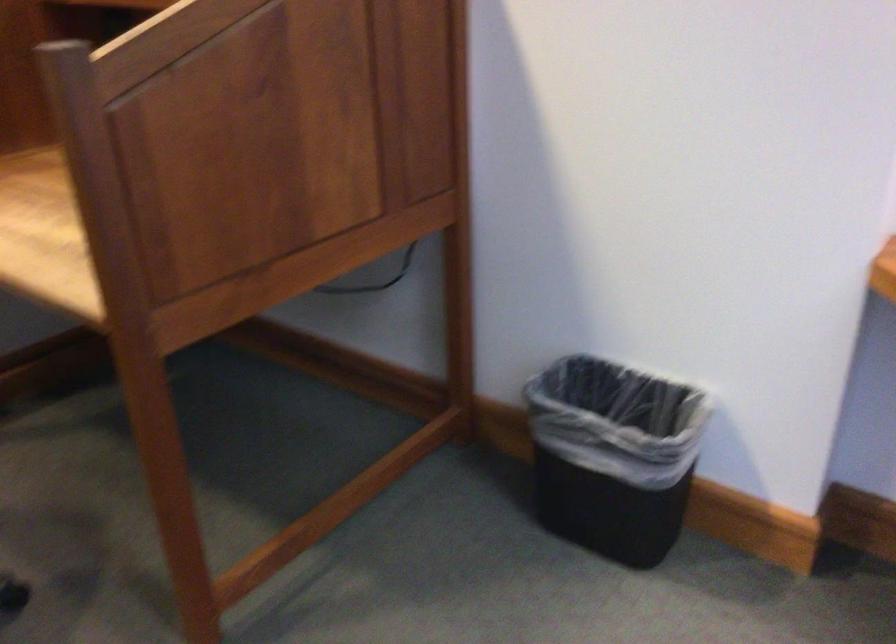
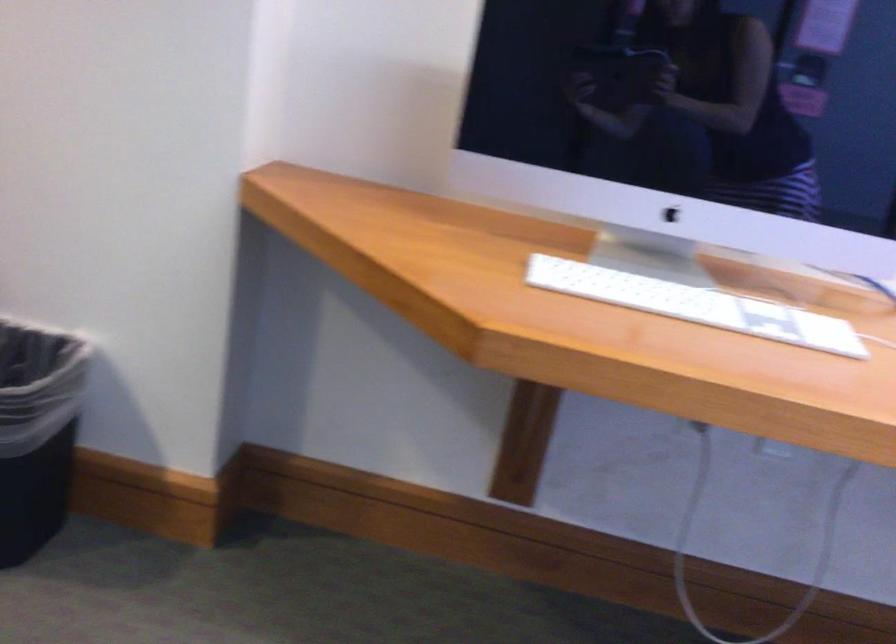
Locate, in the second image, the point that corresponds to point 679,467 in the first image.

(37, 431)